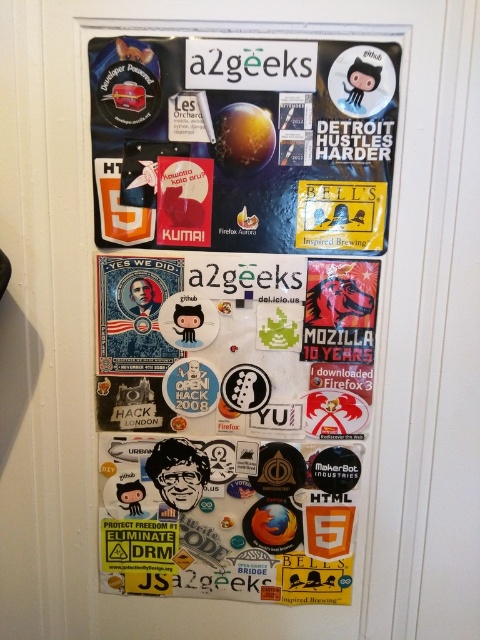
Question: Is multicolored stickers at center above matte paper poster at upper center?

Choices:
 (A) no
 (B) yes

Answer: (A)

Question: Does multicolored stickers at center appear under matte paper poster at upper center?

Choices:
 (A) no
 (B) yes

Answer: (B)

Question: Does multicolored stickers at center appear under matte paper poster at upper center?

Choices:
 (A) yes
 (B) no

Answer: (A)

Question: Which object appears closest to the camera in this image?

Choices:
 (A) multicolored stickers at center
 (B) matte paper poster at upper center

Answer: (B)

Question: Which of the following is the closest to the observer?

Choices:
 (A) multicolored stickers at center
 (B) matte paper poster at upper center

Answer: (B)